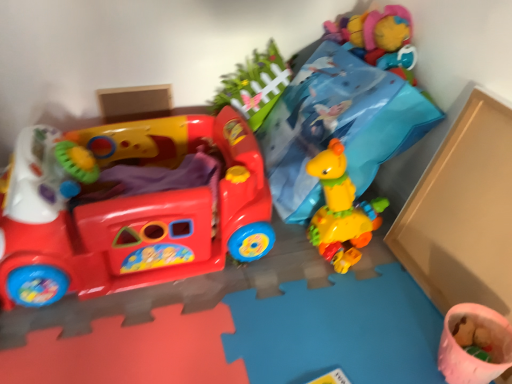
Locate an element on the screen. The image size is (512, 384). vacant space to the left of pink fabric cup at lower right, the 1th toy viewed from the right is located at coordinates (372, 340).